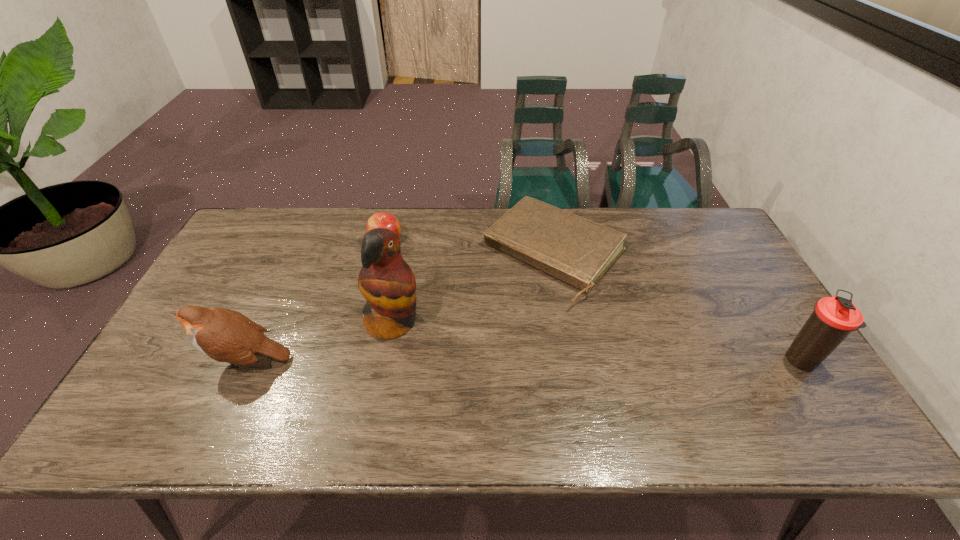
Where is `free space between the fourth tallest object and the leftmost object`? This screenshot has width=960, height=540. free space between the fourth tallest object and the leftmost object is located at coordinates (317, 301).

Where is `vacant space in between the third shortest object and the apple`? This screenshot has width=960, height=540. vacant space in between the third shortest object and the apple is located at coordinates (317, 301).

Find the location of `vacant area between the fourth object from left to right and the apple`. vacant area between the fourth object from left to right and the apple is located at coordinates (470, 248).

Identify which object is located as the fourth nearest to the thermos bottle. Please provide its 2D coordinates. Your answer should be formatted as a tuple, i.e. [(x, y)], where the tuple contains the x and y coordinates of a point satisfying the conditions above.

[(224, 335)]

Select which object is the second closest to the apple. Please provide its 2D coordinates. Your answer should be formatted as a tuple, i.e. [(x, y)], where the tuple contains the x and y coordinates of a point satisfying the conditions above.

[(578, 251)]

Locate an element on the screen. vacant position in the image that satisfies the following two spatial constraints: 1. on the front side of the parrot; 2. on the left side of the second shortest object is located at coordinates (367, 323).

The height and width of the screenshot is (540, 960). Find the location of `vacant area in the image that satisfies the following two spatial constraints: 1. on the front side of the parrot; 2. on the left side of the apple`. vacant area in the image that satisfies the following two spatial constraints: 1. on the front side of the parrot; 2. on the left side of the apple is located at coordinates (367, 323).

Where is `free space that satisfies the following two spatial constraints: 1. on the back side of the fourth object from left to right; 2. on the right side of the tallest object`? The height and width of the screenshot is (540, 960). free space that satisfies the following two spatial constraints: 1. on the back side of the fourth object from left to right; 2. on the right side of the tallest object is located at coordinates (405, 254).